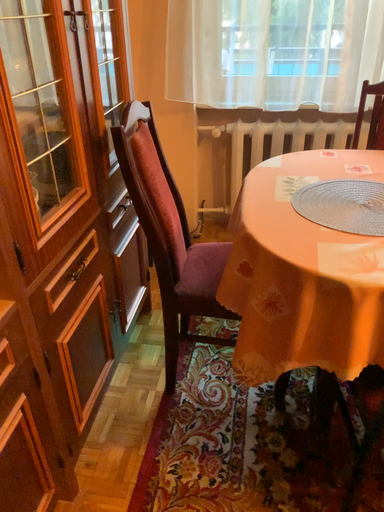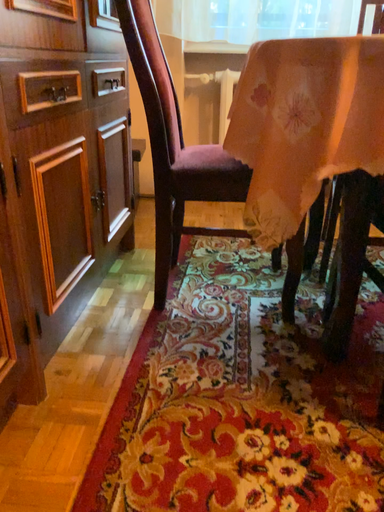
Question: Which way did the camera rotate in the video?

Choices:
 (A) rotated downward
 (B) rotated upward

Answer: (B)